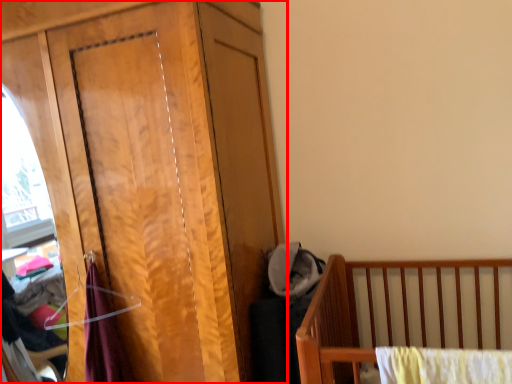
Question: Observing the image, what is the correct spatial positioning of dresser (annotated by the red box) in reference to baby clothe?

Choices:
 (A) right
 (B) left

Answer: (B)